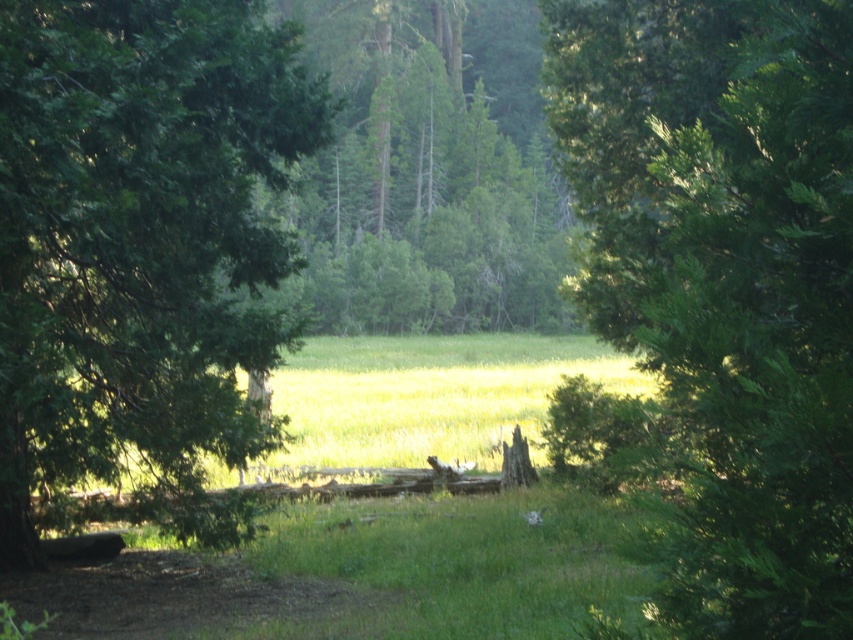
Question: Does green needle-like at center have a lesser width compared to green textured tree at center?

Choices:
 (A) yes
 (B) no

Answer: (A)

Question: Does green needle-like at center appear on the left side of green leafy tree at left?

Choices:
 (A) no
 (B) yes

Answer: (A)

Question: Among these points, which one is nearest to the camera?

Choices:
 (A) (556, 460)
 (B) (492, 49)

Answer: (A)

Question: From the image, what is the correct spatial relationship of green needle-like at center in relation to green textured tree at center?

Choices:
 (A) right
 (B) left

Answer: (A)

Question: Which object appears farthest from the camera in this image?

Choices:
 (A) green leafy tree at left
 (B) green textured tree at center

Answer: (B)

Question: Which point is closer to the camera?

Choices:
 (A) (828, 547)
 (B) (479, 86)
 (C) (26, 205)

Answer: (A)